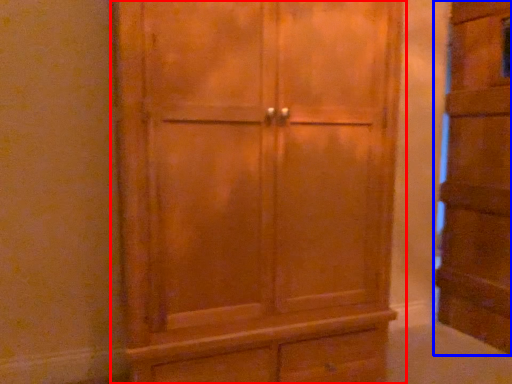
Question: Which of the following is the closest to the observer, cupboard (highlighted by a red box) or cupboard (highlighted by a blue box)?

Choices:
 (A) cupboard
 (B) cupboard

Answer: (A)